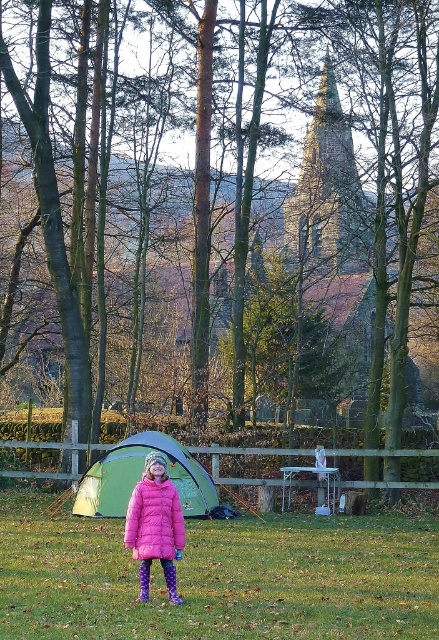
Who is higher up, green grass at center or purple fabric boot at lower center?

purple fabric boot at lower center

Based on the photo, can you confirm if green grass at center is shorter than purple fabric boot at lower center?

Incorrect, green grass at center's height does not fall short of purple fabric boot at lower center's.

Who is more forward, (423, 566) or (166, 566)?

Point (166, 566) is in front.

You are a GUI agent. You are given a task and a screenshot of the screen. Output one action in this format:
    pyautogui.click(x=<x>, y=<y>)
    Task: Click on the green grass at center
    The height and width of the screenshot is (640, 439).
    Given the screenshot: What is the action you would take?
    pyautogui.click(x=219, y=579)

Between green grass at center and green fabric tent at center, which one appears on the right side from the viewer's perspective?

From the viewer's perspective, green grass at center appears more on the right side.

Is green grass at center further to camera compared to green fabric tent at center?

That is False.

At what (x,y) coordinates should I click in order to perform the action: click on green grass at center. Please return your answer as a coordinate pair (x, y). Looking at the image, I should click on (219, 579).

You are a GUI agent. You are given a task and a screenshot of the screen. Output one action in this format:
    pyautogui.click(x=<x>, y=<y>)
    Task: Click on the pink down jacket at center
    The width and height of the screenshot is (439, 640).
    Given the screenshot: What is the action you would take?
    pyautogui.click(x=154, y=520)

The width and height of the screenshot is (439, 640). In order to click on pink down jacket at center in this screenshot , I will do `click(154, 520)`.